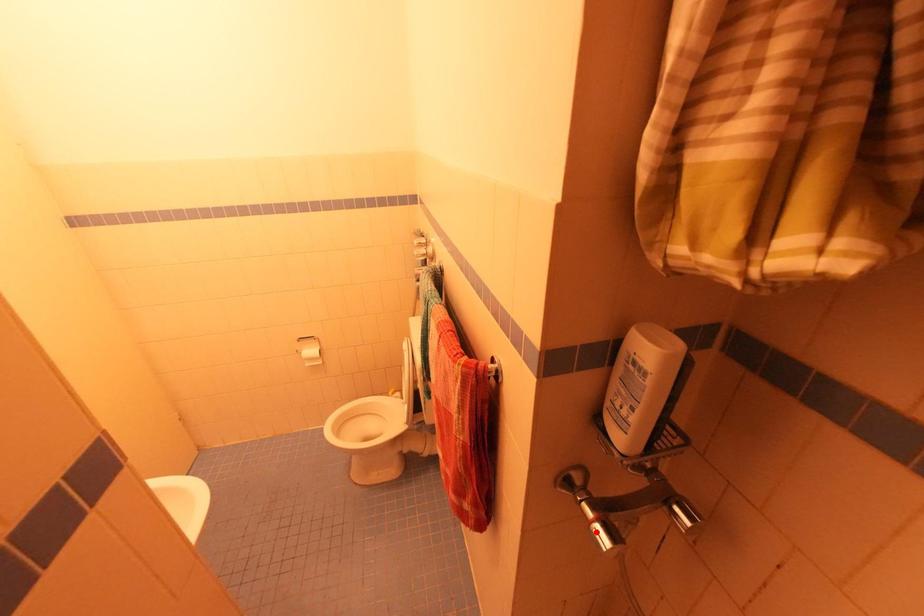
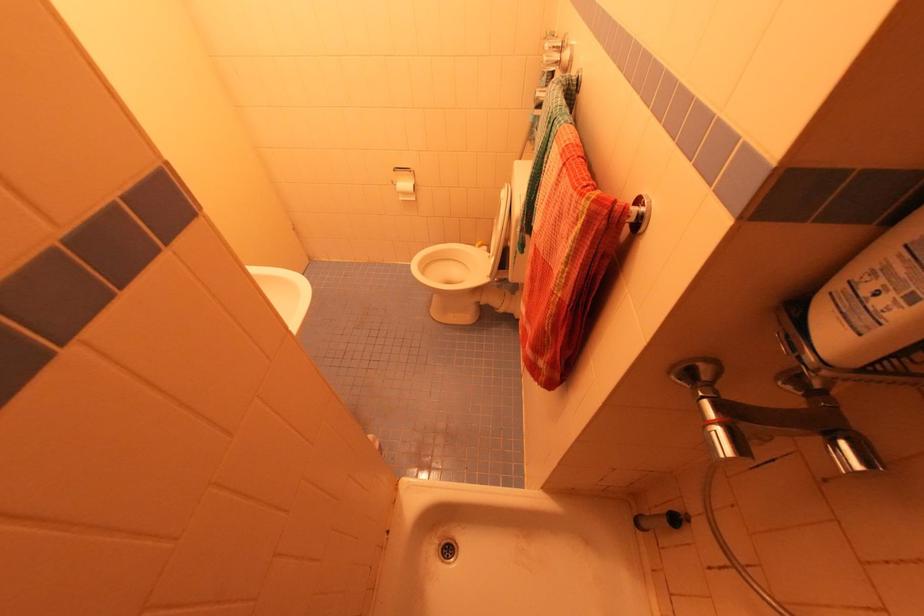
In the second image, find the point that corresponds to the highlighted location in the first image.

(715, 434)